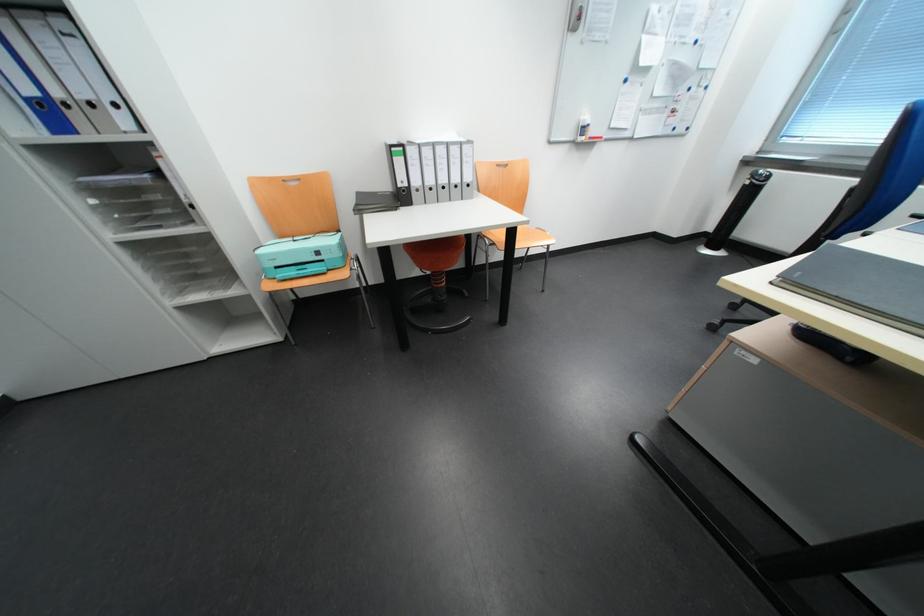
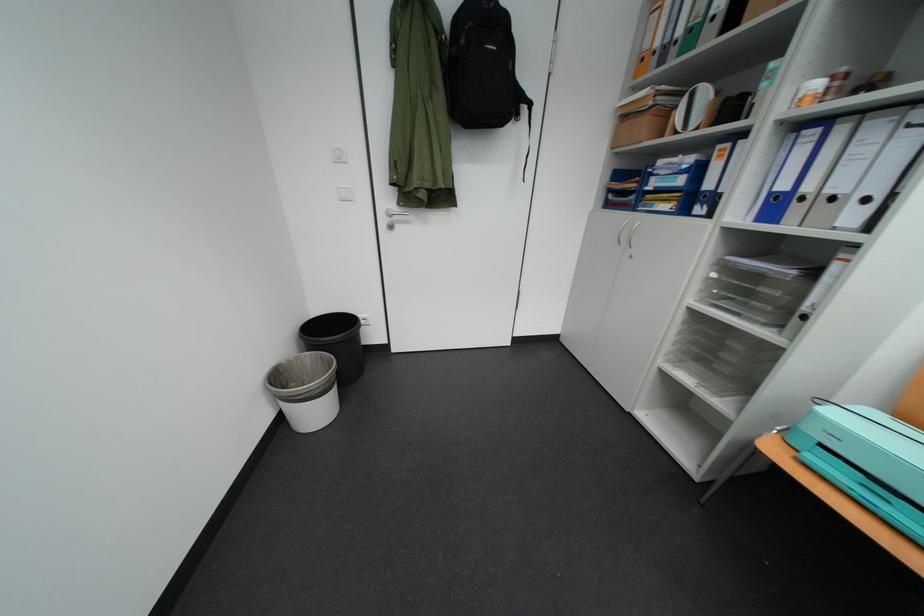
Locate, in the second image, the point that corresponds to [38,102] in the first image.

(782, 196)